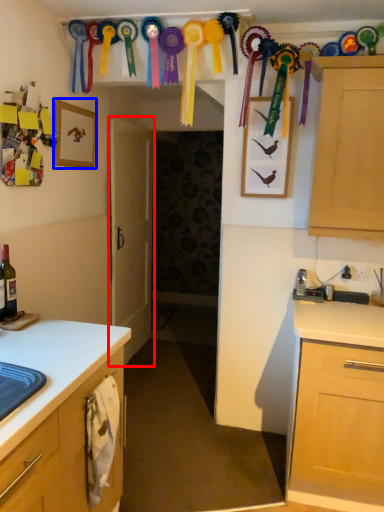
Question: Which object is closer to the camera taking this photo, door (highlighted by a red box) or picture frame (highlighted by a blue box)?

Choices:
 (A) door
 (B) picture frame

Answer: (B)